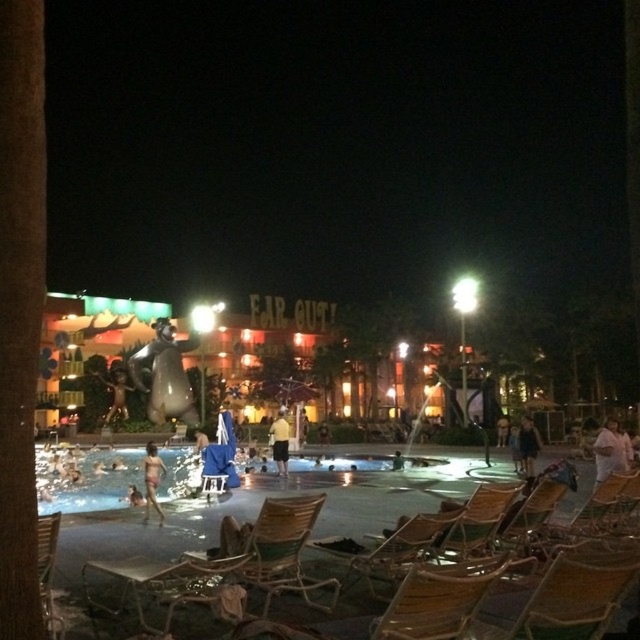
Can you confirm if tan skin human at lower left is smaller than dark blue dress at center?

No.

Can you confirm if tan skin human at lower left is shorter than dark blue dress at center?

Incorrect, tan skin human at lower left's height does not fall short of dark blue dress at center's.

The width and height of the screenshot is (640, 640). I want to click on tan skin human at lower left, so click(x=150, y=481).

You are a GUI agent. You are given a task and a screenshot of the screen. Output one action in this format:
    pyautogui.click(x=<x>, y=<y>)
    Task: Click on the tan skin human at lower left
    Image resolution: width=640 pixels, height=640 pixels.
    Given the screenshot: What is the action you would take?
    pyautogui.click(x=150, y=481)

Which is more to the right, transparent plastic pool at lower left or yellow cotton shorts at center?

From the viewer's perspective, yellow cotton shorts at center appears more on the right side.

Does transparent plastic pool at lower left come in front of yellow cotton shorts at center?

Yes.

Does point (60, 481) come closer to viewer compared to point (280, 442)?

Yes, it is in front of point (280, 442).

Image resolution: width=640 pixels, height=640 pixels. Find the location of `transparent plastic pool at lower left`. transparent plastic pool at lower left is located at coordinates (113, 477).

Is wooden textured beach chair at lower right to the right of yellow cotton shorts at center from the viewer's perspective?

Indeed, wooden textured beach chair at lower right is positioned on the right side of yellow cotton shorts at center.

Can you confirm if wooden textured beach chair at lower right is positioned above yellow cotton shorts at center?

Yes, wooden textured beach chair at lower right is above yellow cotton shorts at center.

Between point (628, 580) and point (272, 435), which one is positioned in front?

Point (628, 580) is more forward.

You are a GUI agent. You are given a task and a screenshot of the screen. Output one action in this format:
    pyautogui.click(x=<x>, y=<y>)
    Task: Click on the wooden textured beach chair at lower right
    This screenshot has height=640, width=640.
    Given the screenshot: What is the action you would take?
    pyautogui.click(x=566, y=598)